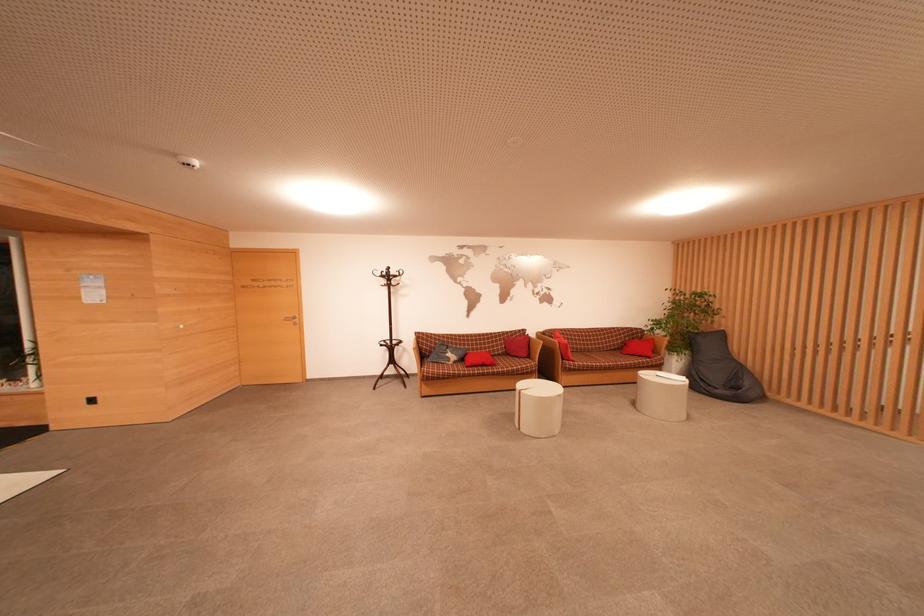
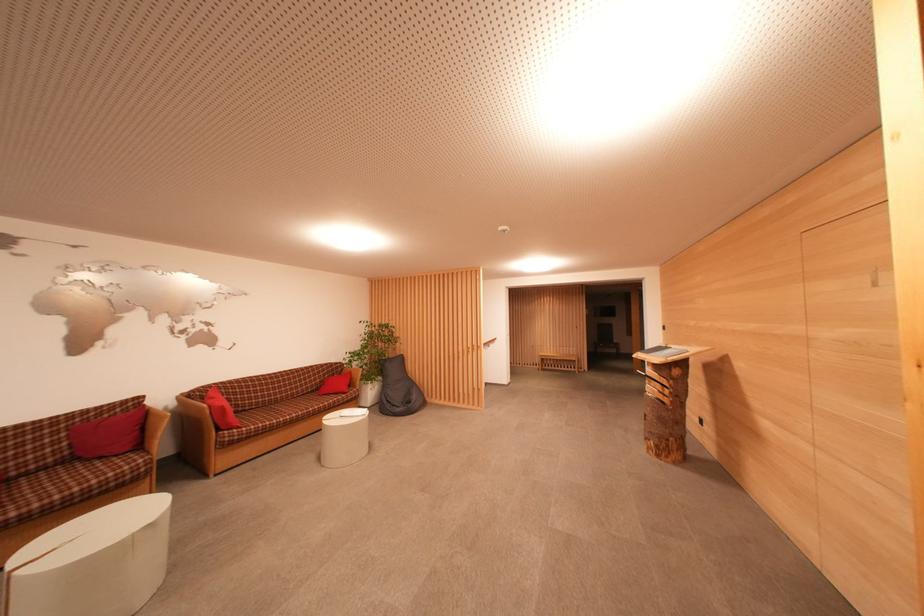
Find the pixel in the second image that matches (x=721, y=331) in the first image.

(402, 357)